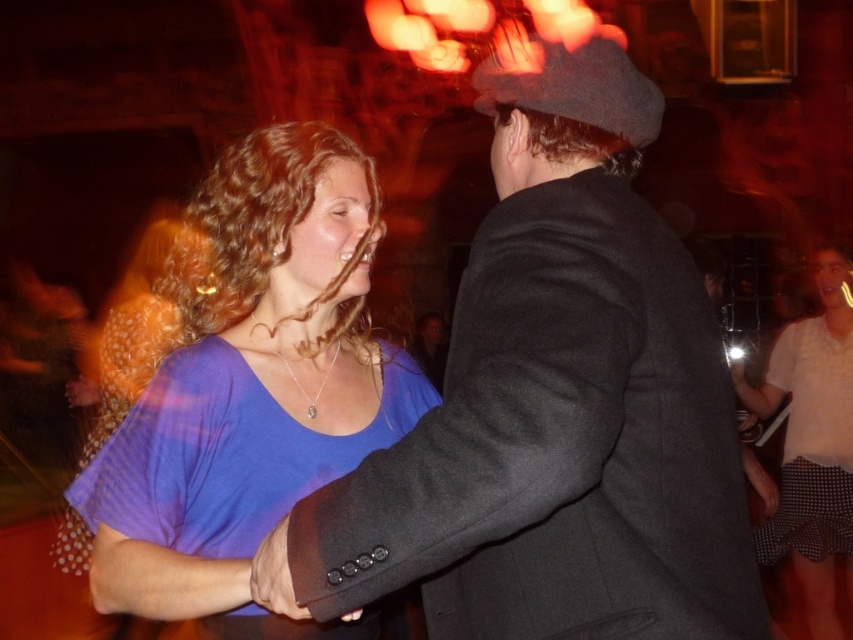
Can you confirm if matte black coat at center is wider than purple fabric dress at center?

No, matte black coat at center is not wider than purple fabric dress at center.

Between matte black coat at center and purple fabric dress at center, which one appears on the left side from the viewer's perspective?

From the viewer's perspective, purple fabric dress at center appears more on the left side.

Is point (538, 561) farther from camera compared to point (74, 547)?

No, it is in front of (74, 547).

Where is `matte black coat at center`? matte black coat at center is located at coordinates (553, 410).

Locate an element on the screen. This screenshot has width=853, height=640. matte black coat at center is located at coordinates (553, 410).

Looking at this image, can you confirm if matte black coat at center is smaller than purple soft fabric blouse at center?

Yes, matte black coat at center is smaller than purple soft fabric blouse at center.

Which is behind, point (647, 550) or point (323, 316)?

Positioned behind is point (323, 316).

The image size is (853, 640). What are the coordinates of `matte black coat at center` in the screenshot? It's located at (553, 410).

Which of these two, matte black coat at center or white dotted skirt at lower right, stands shorter?

matte black coat at center

Does matte black coat at center appear on the right side of white dotted skirt at lower right?

No, matte black coat at center is not to the right of white dotted skirt at lower right.

You are a GUI agent. You are given a task and a screenshot of the screen. Output one action in this format:
    pyautogui.click(x=<x>, y=<y>)
    Task: Click on the matte black coat at center
    This screenshot has width=853, height=640.
    Given the screenshot: What is the action you would take?
    pyautogui.click(x=553, y=410)